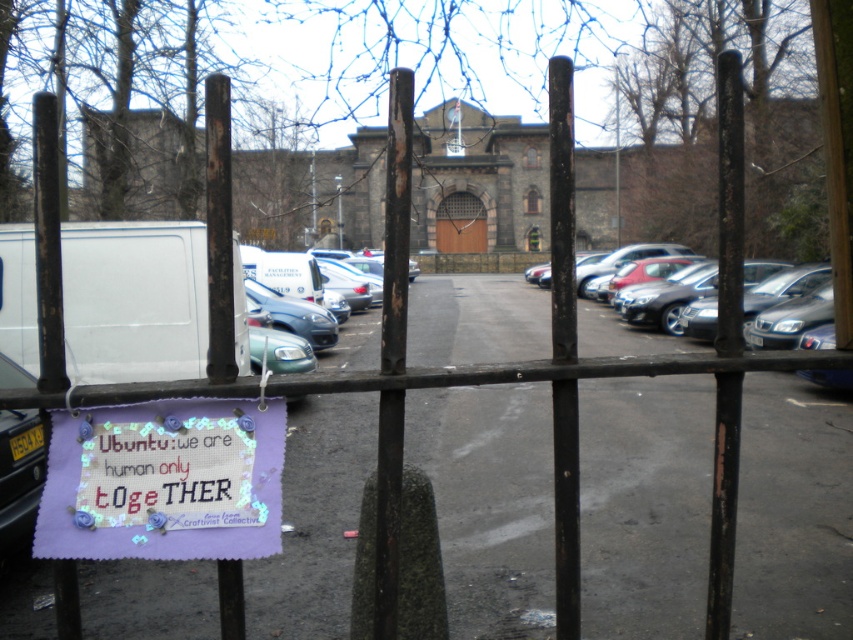
Question: Which point is closer to the camera taking this photo?

Choices:
 (A) (653, 324)
 (B) (442, 216)

Answer: (A)

Question: Which object appears farthest from the camera in this image?

Choices:
 (A) brown stone door at center
 (B) metallic blue car at center
 (C) shiny silver sedan at right
 (D) lavender fabric sign at lower left

Answer: (A)

Question: Which object is farther from the camera taking this photo?

Choices:
 (A) metallic blue car at center
 (B) lavender fabric sign at lower left
 (C) shiny silver sedan at right

Answer: (C)

Question: Can you confirm if lavender fabric sign at lower left is positioned above brown stone door at center?

Choices:
 (A) no
 (B) yes

Answer: (A)

Question: Does lavender fabric sign at lower left appear under metallic blue car at center?

Choices:
 (A) yes
 (B) no

Answer: (A)

Question: Is shiny silver sedan at right above metallic blue car at center?

Choices:
 (A) no
 (B) yes

Answer: (B)